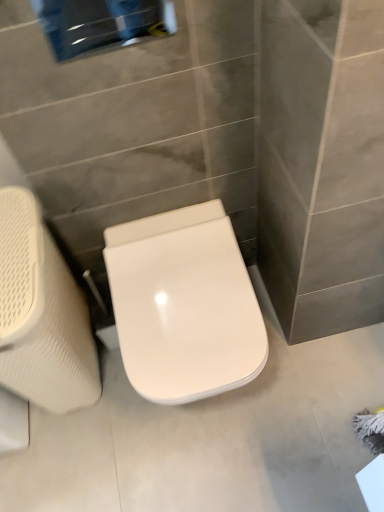
The image size is (384, 512). In order to click on white glossy toilet seat at center in this screenshot , I will do `click(184, 305)`.

The image size is (384, 512). What do you see at coordinates (184, 305) in the screenshot? I see `white glossy toilet seat at center` at bounding box center [184, 305].

You are a GUI agent. You are given a task and a screenshot of the screen. Output one action in this format:
    pyautogui.click(x=<x>, y=<y>)
    Task: Click on the white textured swivel chair at left
    The width and height of the screenshot is (384, 512).
    Given the screenshot: What is the action you would take?
    pyautogui.click(x=42, y=314)

The width and height of the screenshot is (384, 512). Describe the element at coordinates (42, 314) in the screenshot. I see `white textured swivel chair at left` at that location.

The width and height of the screenshot is (384, 512). I want to click on white glossy toilet seat at center, so click(184, 305).

Is white glossy toilet seat at center to the left of white textured swivel chair at left from the viewer's perspective?

Incorrect, white glossy toilet seat at center is not on the left side of white textured swivel chair at left.

Considering the positions of objects white glossy toilet seat at center and white textured swivel chair at left in the image provided, who is behind, white glossy toilet seat at center or white textured swivel chair at left?

Positioned behind is white glossy toilet seat at center.

Does point (219, 281) come in front of point (26, 292)?

No.

From the image's perspective, does white glossy toilet seat at center appear lower than white textured swivel chair at left?

Actually, white glossy toilet seat at center appears above white textured swivel chair at left in the image.

From a real-world perspective, is white glossy toilet seat at center above or below white textured swivel chair at left?

In terms of real-world spatial position, white glossy toilet seat at center is below white textured swivel chair at left.

Considering the relative sizes of white glossy toilet seat at center and white textured swivel chair at left in the image provided, is white glossy toilet seat at center thinner than white textured swivel chair at left?

No, white glossy toilet seat at center is not thinner than white textured swivel chair at left.

Is white glossy toilet seat at center shorter than white textured swivel chair at left?

Indeed, white glossy toilet seat at center has a lesser height compared to white textured swivel chair at left.

Between white glossy toilet seat at center and white textured swivel chair at left, which one has larger size?

Bigger between the two is white textured swivel chair at left.

Do you think white glossy toilet seat at center is within white textured swivel chair at left, or outside of it?

white glossy toilet seat at center is not inside white textured swivel chair at left, it's outside.

Is white glossy toilet seat at center far away from white textured swivel chair at left?

No, there isn't a large distance between white glossy toilet seat at center and white textured swivel chair at left.

Is white glossy toilet seat at center oriented towards white textured swivel chair at left?

No, white glossy toilet seat at center is not turned towards white textured swivel chair at left.

In the scene shown: Can you tell me how much white glossy toilet seat at center and white textured swivel chair at left differ in facing direction?

They differ by 0.366 degrees in their facing directions.

I want to click on swivel chair on the left of the white glossy toilet seat at center, so click(42, 314).

Which object is positioned more to the left, white textured swivel chair at left or white glossy toilet seat at center?

white textured swivel chair at left.

Who is more distant, white textured swivel chair at left or white glossy toilet seat at center?

Positioned behind is white glossy toilet seat at center.

Is point (49, 372) closer to viewer compared to point (191, 262)?

That is True.

From the image's perspective, would you say white textured swivel chair at left is positioned over white glossy toilet seat at center?

Actually, white textured swivel chair at left appears below white glossy toilet seat at center in the image.

Looking at this image, from a real-world perspective, relative to white glossy toilet seat at center, is white textured swivel chair at left vertically above or below?

Clearly, from a real-world perspective, white textured swivel chair at left is above white glossy toilet seat at center.

Which of these two, white textured swivel chair at left or white glossy toilet seat at center, is wider?

Wider between the two is white glossy toilet seat at center.

In the scene shown: Between white textured swivel chair at left and white glossy toilet seat at center, which one has more height?

white textured swivel chair at left.

Can you confirm if white textured swivel chair at left is smaller than white glossy toilet seat at center?

Incorrect, white textured swivel chair at left is not smaller in size than white glossy toilet seat at center.

Is white glossy toilet seat at center located within white textured swivel chair at left?

No, white textured swivel chair at left does not contain white glossy toilet seat at center.

Is white textured swivel chair at left far from white glossy toilet seat at center?

white textured swivel chair at left is near white glossy toilet seat at center, not far away.

Does white textured swivel chair at left turn towards white glossy toilet seat at center?

No, white textured swivel chair at left does not turn towards white glossy toilet seat at center.

What's the angular difference between white textured swivel chair at left and white glossy toilet seat at center's facing directions?

The angular difference between white textured swivel chair at left and white glossy toilet seat at center is 0.366 degrees.

Measure the distance between white textured swivel chair at left and white glossy toilet seat at center.

The distance of white textured swivel chair at left from white glossy toilet seat at center is 11.52 inches.

This screenshot has height=512, width=384. I want to click on swivel chair below the white glossy toilet seat at center (from the image's perspective), so click(42, 314).

Locate an element on the screen. swivel chair above the white glossy toilet seat at center (from a real-world perspective) is located at coordinates (42, 314).

You are a GUI agent. You are given a task and a screenshot of the screen. Output one action in this format:
    pyautogui.click(x=<x>, y=<y>)
    Task: Click on the swivel chair in front of the white glossy toilet seat at center
    The height and width of the screenshot is (512, 384).
    Given the screenshot: What is the action you would take?
    (42, 314)